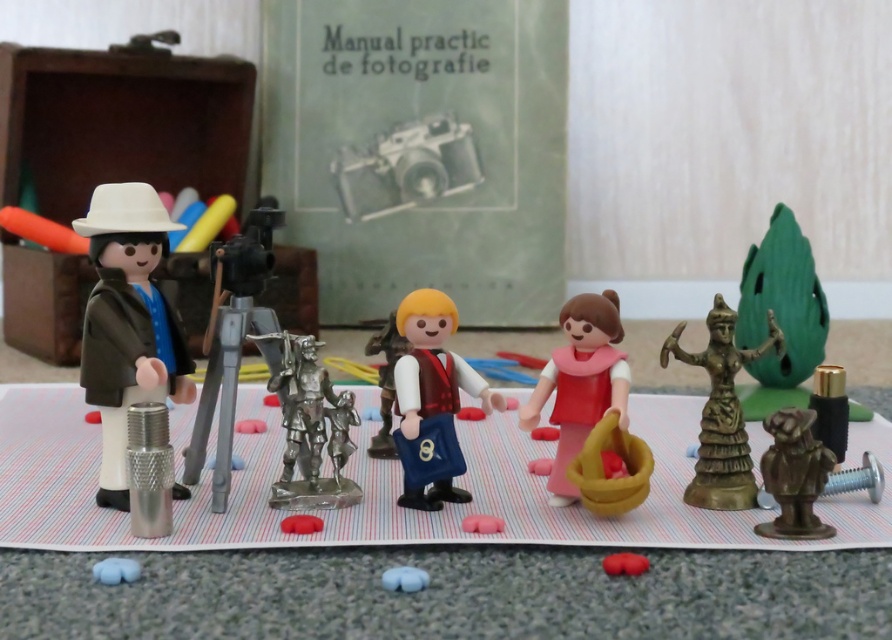
Question: Does pink matte doll at center come behind matte silver camera at center?

Choices:
 (A) yes
 (B) no

Answer: (B)

Question: Is shiny silver statue at center wider than bronze statue at lower right?

Choices:
 (A) yes
 (B) no

Answer: (A)

Question: Which of the following is the farthest from the observer?

Choices:
 (A) (661, 365)
 (B) (263, 353)
 (C) (451, 131)

Answer: (C)

Question: Among these points, which one is nearest to the camera?

Choices:
 (A) (417, 570)
 (B) (647, 561)
 (C) (378, 157)
 (D) (286, 524)

Answer: (A)

Question: Is matte black figure at left bigger than pink matte doll at center?

Choices:
 (A) no
 (B) yes

Answer: (B)

Question: Which point appears closest to the camera in this image?

Choices:
 (A) (252, 218)
 (B) (122, 579)

Answer: (B)